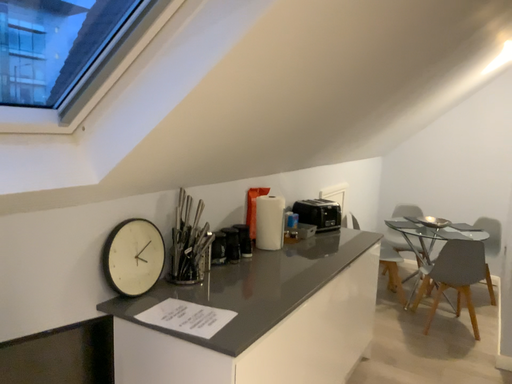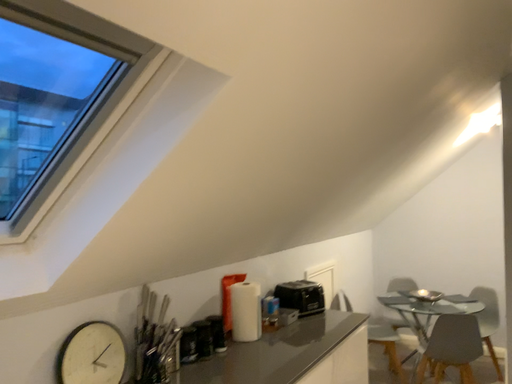
Question: Which way did the camera rotate in the video?

Choices:
 (A) rotated downward
 (B) rotated upward

Answer: (B)